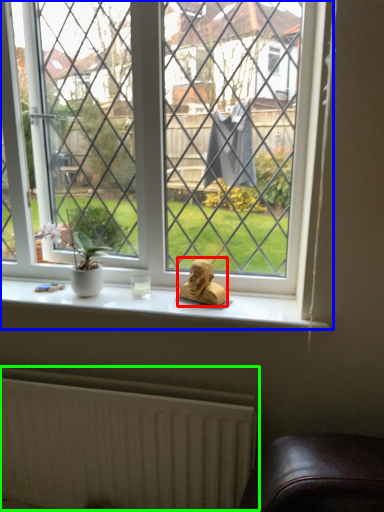
Question: Which object is the farthest from animal (highlighted by a red box)? Choose among these: window (highlighted by a blue box) or radiator (highlighted by a green box).

Choices:
 (A) window
 (B) radiator

Answer: (B)